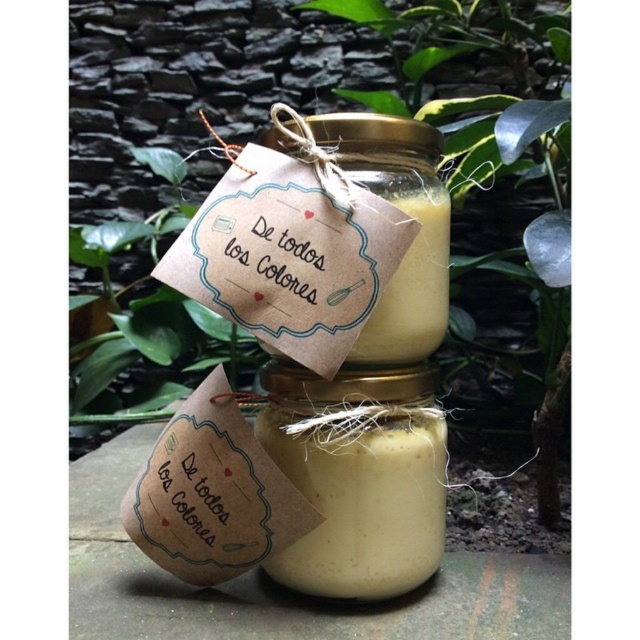
You are a delivery person who needs to place a package between the green leafy plant at center and the yellow matte jar at center. Can you fit the package if it is 1 foot wide?

The green leafy plant at center is wider than the yellow matte jar at center. The space between them may be limited, but since the exact distance isn

You are a photographer setting up a shot of the green leafy plant at center. The camera is positioned 31.45 inches away from the plant. If you want to capture the entire plant in the frame without moving the camera, what adjustment should you make?

The green leafy plant at center is 31.45 inches away from the camera. To capture the entire plant in the frame without moving the camera, you should adjust the zoom lens to a wider angle.

You are standing 4 feet away from the stone surface where the jars are placed. If you move forward 0.64 feet, will you be closer to the point at coordinates point (548, 435) than the jars?

The distance of point point (548, 435) from camera is 3.36 feet. After moving forward 0.64 feet from your initial position of 4 feet away, you will be 3.36 feet away, which matches the distance of the point. Therefore, you will be at the same distance as the point point (548, 435), so you will be equally close to the point and the jars.